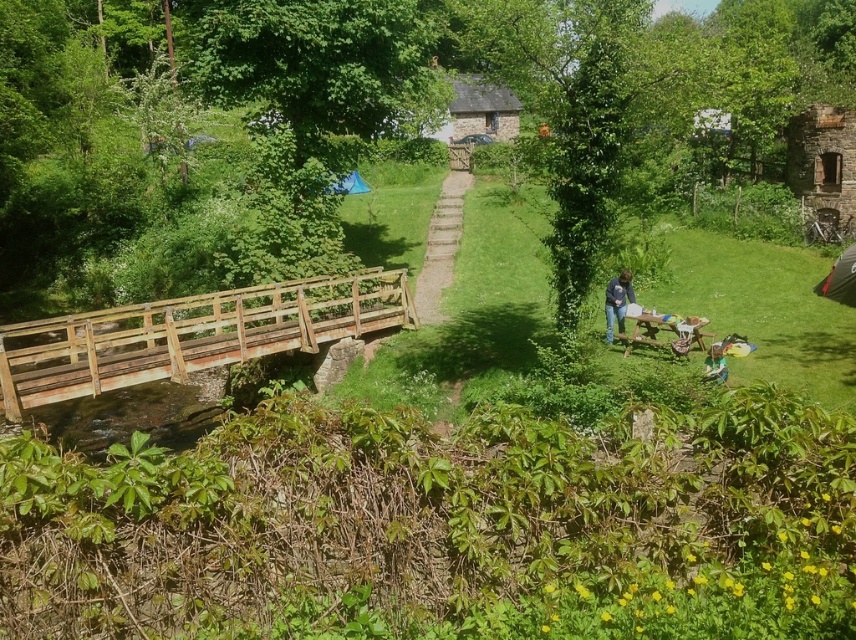
Question: Which point is farther to the camera?

Choices:
 (A) wooden stairs at center
 (B) wooden bridge at lower left
 (C) blue denim jeans at center

Answer: (A)

Question: Is wooden bridge at lower left positioned behind blue denim jeans at center?

Choices:
 (A) no
 (B) yes

Answer: (A)

Question: Which point is farther to the camera?

Choices:
 (A) [x=611, y=326]
 (B) [x=366, y=276]
 (C) [x=440, y=188]

Answer: (C)

Question: Where is wooden bridge at lower left located in relation to wooden stairs at center in the image?

Choices:
 (A) right
 (B) left

Answer: (B)

Question: Among these points, which one is farthest from the camera?

Choices:
 (A) (613, 321)
 (B) (52, 392)
 (C) (449, 173)

Answer: (C)

Question: Can you confirm if wooden stairs at center is positioned below blue denim jeans at center?

Choices:
 (A) no
 (B) yes

Answer: (A)